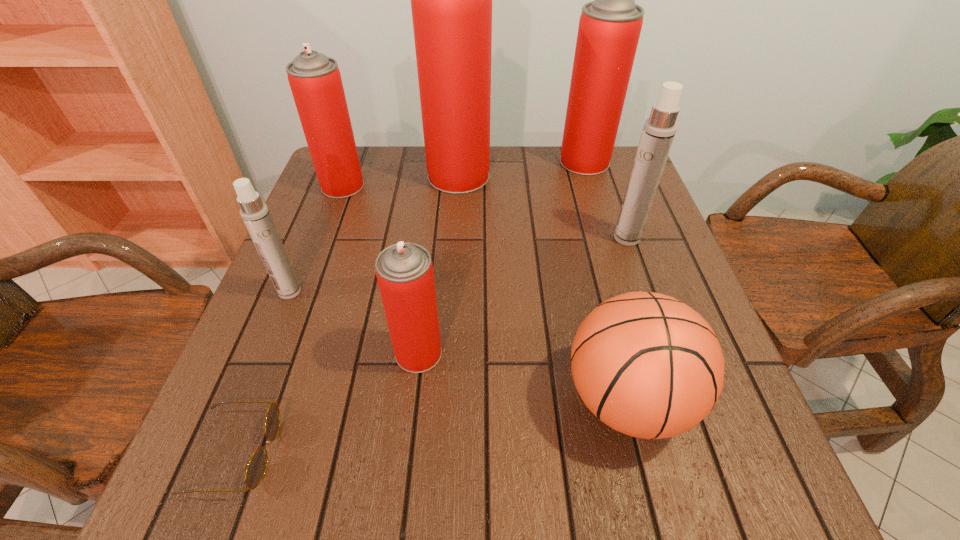
Where is `the tallest aerosol can`? The height and width of the screenshot is (540, 960). the tallest aerosol can is located at coordinates (451, 0).

Where is `the biggest red aerosol can`? the biggest red aerosol can is located at coordinates (451, 0).

You are a GUI agent. You are given a task and a screenshot of the screen. Output one action in this format:
    pyautogui.click(x=<x>, y=<y>)
    Task: Click on the rightmost red aerosol can
    This screenshot has width=960, height=540.
    Given the screenshot: What is the action you would take?
    pyautogui.click(x=609, y=28)

The image size is (960, 540). What are the coordinates of `the second biggest red aerosol can` in the screenshot? It's located at (609, 28).

Find the location of `the leftmost red aerosol can`. the leftmost red aerosol can is located at coordinates (315, 80).

Where is `the farther white aerosol can`? the farther white aerosol can is located at coordinates (659, 130).

Locate an element on the screen. The width and height of the screenshot is (960, 540). the right white aerosol can is located at coordinates (659, 130).

Where is `the smallest red aerosol can`? The height and width of the screenshot is (540, 960). the smallest red aerosol can is located at coordinates (404, 271).

At what (x,y) coordinates should I click in order to perform the action: click on the nearest red aerosol can. Please return your answer as a coordinate pair (x, y). The height and width of the screenshot is (540, 960). Looking at the image, I should click on (404, 271).

Identify the location of the left white aerosol can. The height and width of the screenshot is (540, 960). (255, 214).